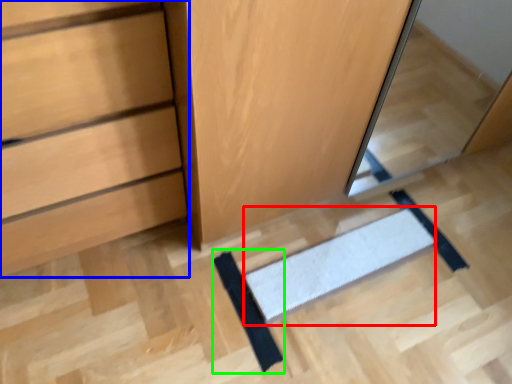
Question: Which object is the closest to the doormat (highlighted by a red box)? Choose among these: chest of drawers (highlighted by a blue box) or doormat (highlighted by a green box).

Choices:
 (A) chest of drawers
 (B) doormat

Answer: (B)